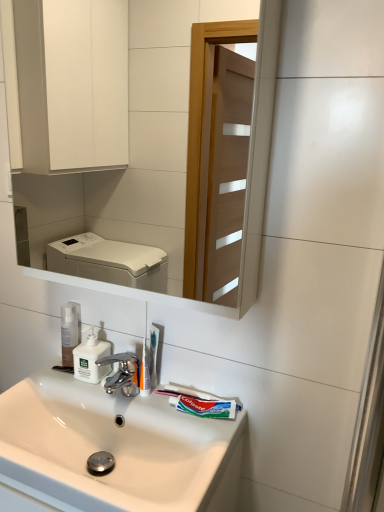
Identify the location of vacant space positioned to the left of white plastic toothbrush at center, acting as the second toothbrush starting from the front. (100, 388).